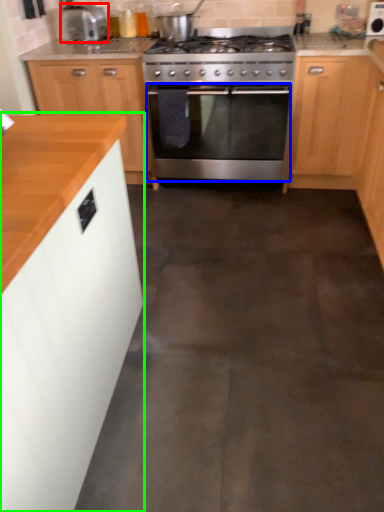
Question: Considering the real-world distances, which object is closest to kitchen appliance (highlighted by a red box)? oven (highlighted by a blue box) or cabinetry (highlighted by a green box).

Choices:
 (A) oven
 (B) cabinetry

Answer: (A)